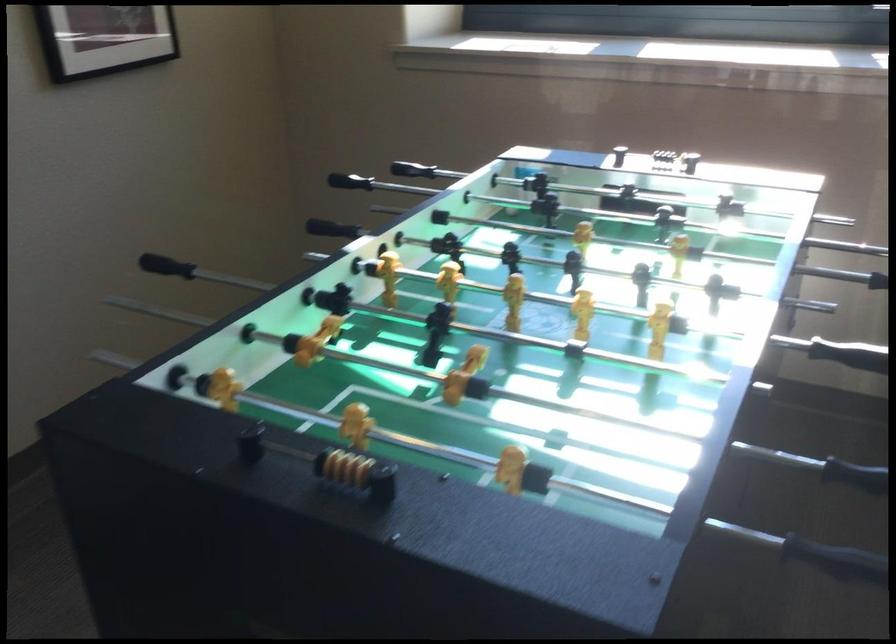
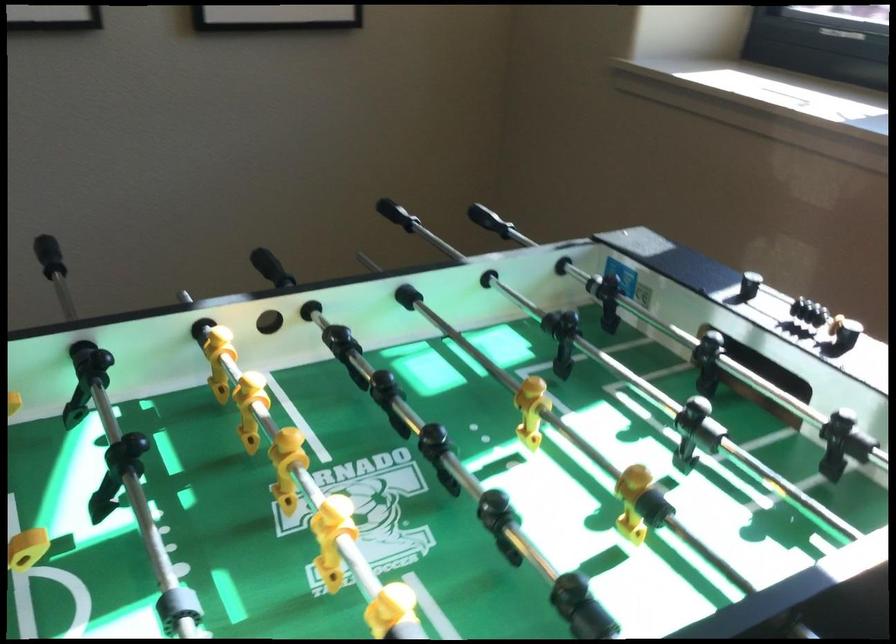
Find the pixel in the second image that matches (x=289, y=199) in the first image.

(488, 220)